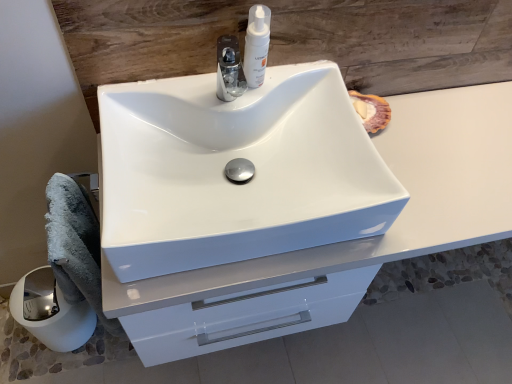
Where is `vacant space in front of white glossy paper towel at lower left`? The height and width of the screenshot is (384, 512). vacant space in front of white glossy paper towel at lower left is located at coordinates (54, 370).